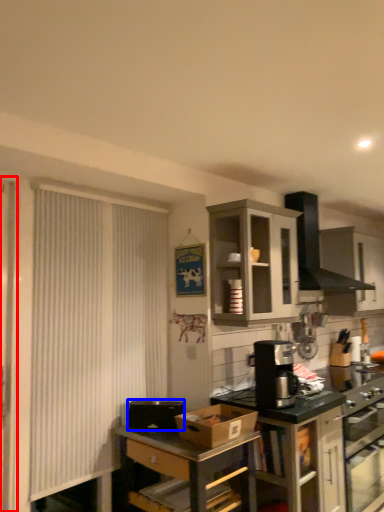
Question: Which of the following is the closest to the observer, screen door (highlighted by a red box) or appliance (highlighted by a blue box)?

Choices:
 (A) screen door
 (B) appliance

Answer: (A)